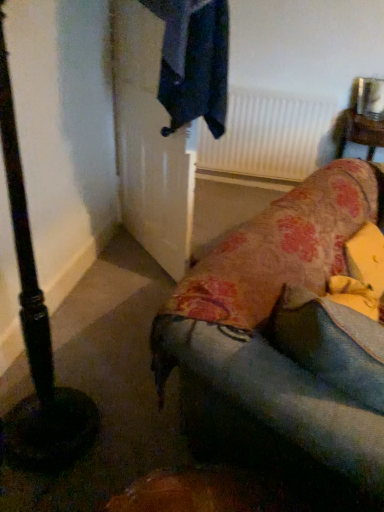
Question: Is white matte radiator at upper center at the back of black matte pole at left?

Choices:
 (A) no
 (B) yes

Answer: (A)

Question: Can you confirm if black matte pole at left is smaller than white matte radiator at upper center?

Choices:
 (A) yes
 (B) no

Answer: (B)

Question: Is black matte pole at left shorter than white matte radiator at upper center?

Choices:
 (A) yes
 (B) no

Answer: (B)

Question: Is black matte pole at left facing towards white matte radiator at upper center?

Choices:
 (A) no
 (B) yes

Answer: (A)

Question: From a real-world perspective, is black matte pole at left over white matte radiator at upper center?

Choices:
 (A) no
 (B) yes

Answer: (B)

Question: In terms of height, does denim cushion at lower right look taller or shorter compared to floral fabric studio couch at lower right?

Choices:
 (A) tall
 (B) short

Answer: (B)

Question: Does point (314, 367) appear closer or farther from the camera than point (256, 397)?

Choices:
 (A) farther
 (B) closer

Answer: (A)

Question: Considering the positions of denim cushion at lower right and floral fabric studio couch at lower right in the image, is denim cushion at lower right wider or thinner than floral fabric studio couch at lower right?

Choices:
 (A) thin
 (B) wide

Answer: (A)

Question: From a real-world perspective, is denim cushion at lower right above or below floral fabric studio couch at lower right?

Choices:
 (A) above
 (B) below

Answer: (B)

Question: From a real-world perspective, is black matte pole at left above or below wooden table at upper right?

Choices:
 (A) below
 (B) above

Answer: (B)

Question: Is black matte pole at left wider or thinner than wooden table at upper right?

Choices:
 (A) thin
 (B) wide

Answer: (B)

Question: Considering the relative positions of black matte pole at left and wooden table at upper right in the image provided, is black matte pole at left to the left or to the right of wooden table at upper right?

Choices:
 (A) right
 (B) left

Answer: (B)

Question: Considering the positions of black matte pole at left and wooden table at upper right in the image, is black matte pole at left bigger or smaller than wooden table at upper right?

Choices:
 (A) big
 (B) small

Answer: (A)

Question: Is point (253, 304) closer or farther from the camera than point (19, 300)?

Choices:
 (A) closer
 (B) farther

Answer: (B)

Question: From the image's perspective, is floral fabric studio couch at lower right positioned above or below black matte pole at left?

Choices:
 (A) below
 (B) above

Answer: (A)